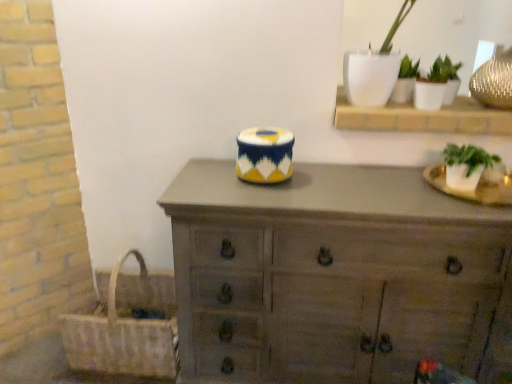
Find the location of a particular element. The width and height of the screenshot is (512, 384). vacant space to the left of white ceramic pot at upper right, which is the 2th houseplant in top-to-bottom order is located at coordinates (390, 111).